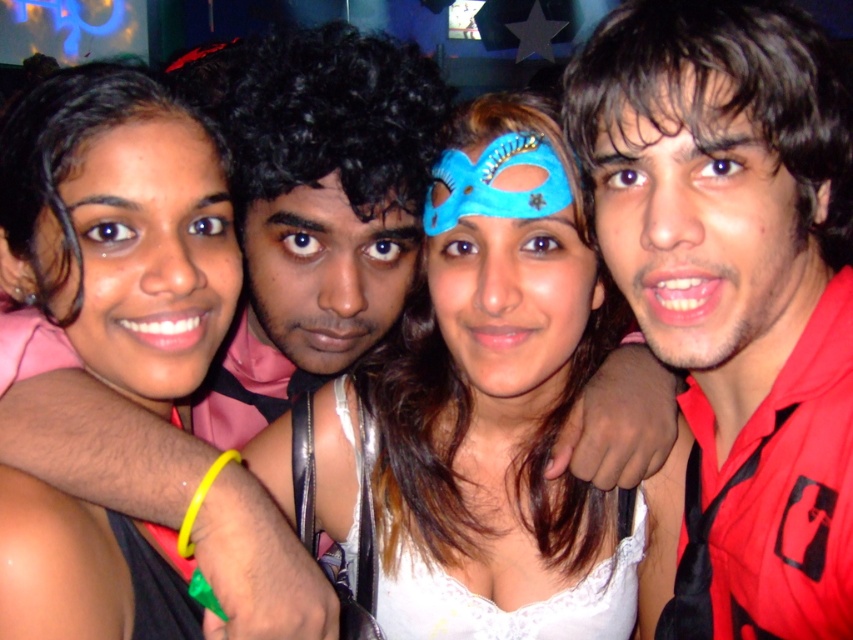
Question: Considering the relative positions of matte black dress at center and white satin dress at center in the image provided, where is matte black dress at center located with respect to white satin dress at center?

Choices:
 (A) below
 (B) above

Answer: (A)

Question: Which of the following is the farthest from the observer?

Choices:
 (A) blue velvet mask at center
 (B) matte pink skin at left

Answer: (A)

Question: Which object appears closest to the camera in this image?

Choices:
 (A) red matte shirt at right
 (B) matte black dress at center
 (C) brown matte face at right

Answer: (B)

Question: Which point is closer to the camera?

Choices:
 (A) (360, 272)
 (B) (607, 179)

Answer: (B)

Question: Can you confirm if matte pink skin at left is smaller than blue velvet mask at center?

Choices:
 (A) no
 (B) yes

Answer: (A)

Question: Can you confirm if brown matte face at right is thinner than blue velvet mask at center?

Choices:
 (A) yes
 (B) no

Answer: (B)